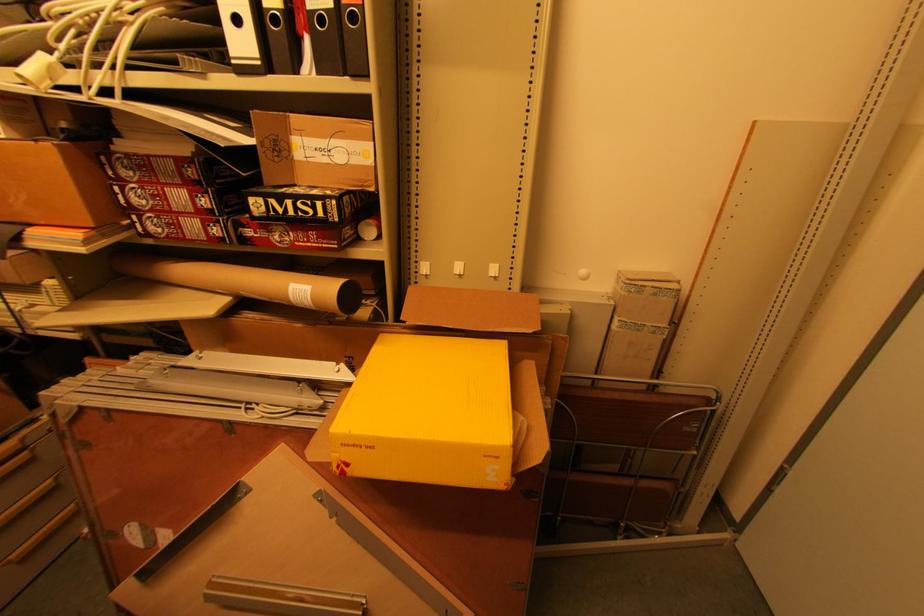
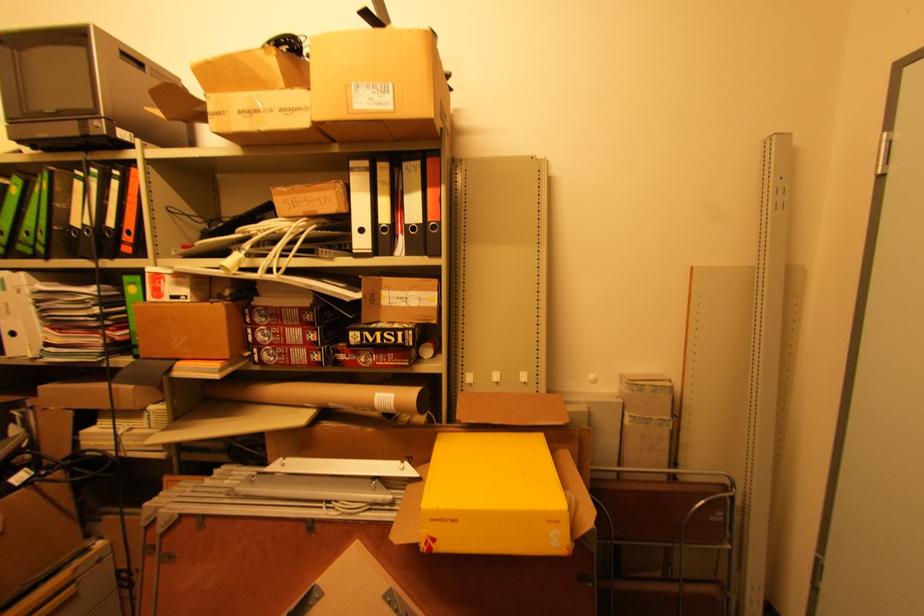
In the second image, find the point that corresponds to [357,447] in the first image.

(444, 521)